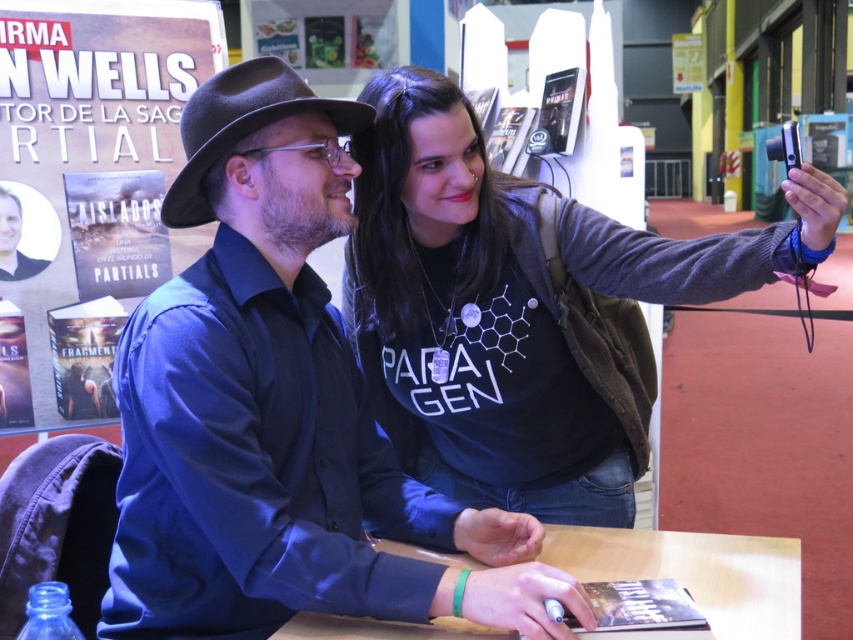
You are a photographer at the event and need to position a light source between the dark gray sweater at upper right and the wooden table at center. How far apart are these two items?

The dark gray sweater at upper right is 41.18 centimeters away from the wooden table at center.

You are attending a book signing event and notice two items of clothing in the scene. The matte black shirt at center and the black felt fedora at upper center. Which clothing item is located to the right of the other?

The matte black shirt at center is positioned on the right side of black felt fedora at upper center.

Based on the scene description, which object is larger in size between the dark gray sweater at upper right and the wooden table at center?

The dark gray sweater at upper right is bigger than the wooden table at center.